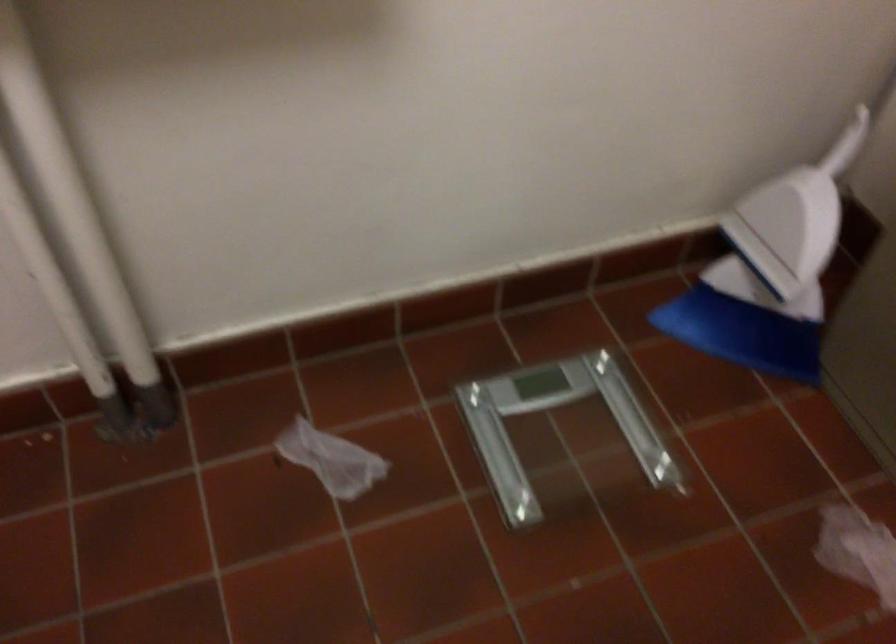
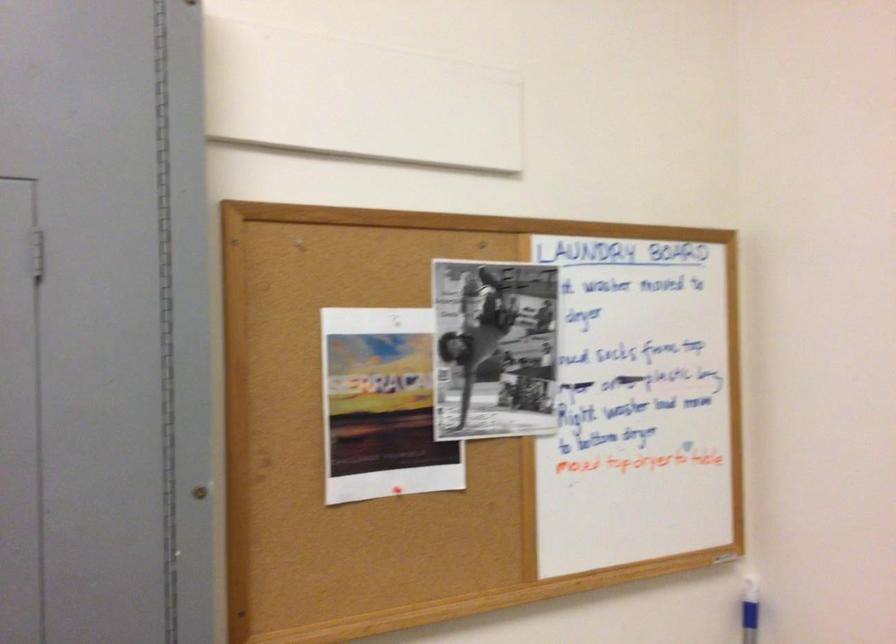
Question: In a continuous first-person perspective shot, in which direction is the camera moving?

Choices:
 (A) Left
 (B) Right
 (C) Forward
 (D) Backward

Answer: (D)